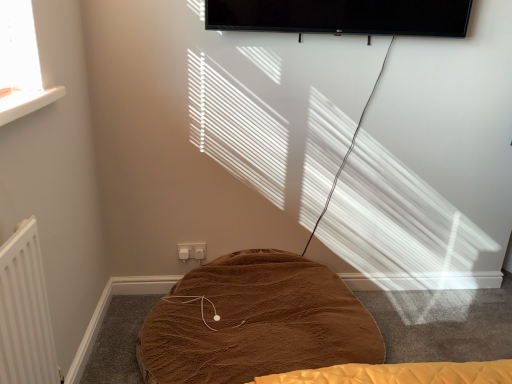
The image size is (512, 384). What do you see at coordinates (255, 322) in the screenshot?
I see `brown plush blanket at center` at bounding box center [255, 322].

The image size is (512, 384). In order to click on brown plush blanket at center in this screenshot , I will do `click(255, 322)`.

At what (x,y) coordinates should I click in order to perform the action: click on white plastic electric outlet at lower center. Please return your answer as a coordinate pair (x, y). Looking at the image, I should click on (192, 251).

What do you see at coordinates (192, 251) in the screenshot? I see `white plastic electric outlet at lower center` at bounding box center [192, 251].

Locate an element on the screen. The height and width of the screenshot is (384, 512). brown plush blanket at center is located at coordinates (255, 322).

Considering the positions of objects white plastic electric outlet at lower center and brown plush blanket at center in the image provided, who is more to the left, white plastic electric outlet at lower center or brown plush blanket at center?

Positioned to the left is white plastic electric outlet at lower center.

Which object is closer to the camera, white plastic electric outlet at lower center or brown plush blanket at center?

Positioned in front is brown plush blanket at center.

Between point (180, 256) and point (256, 283), which one is positioned behind?

Point (180, 256)

Based on the photo, from the image's perspective, is white plastic electric outlet at lower center above brown plush blanket at center?

Yes.

From a real-world perspective, is white plastic electric outlet at lower center above or below brown plush blanket at center?

white plastic electric outlet at lower center is situated higher than brown plush blanket at center in the real world.

Which of these two, white plastic electric outlet at lower center or brown plush blanket at center, is wider?

brown plush blanket at center is wider.

Considering the relative sizes of white plastic electric outlet at lower center and brown plush blanket at center in the image provided, is white plastic electric outlet at lower center taller than brown plush blanket at center?

Incorrect, the height of white plastic electric outlet at lower center is not larger of that of brown plush blanket at center.

Is white plastic electric outlet at lower center smaller than brown plush blanket at center?

Yes.

Is white plastic electric outlet at lower center inside or outside of brown plush blanket at center?

white plastic electric outlet at lower center is spatially situated outside brown plush blanket at center.

Does white plastic electric outlet at lower center touch brown plush blanket at center?

No, white plastic electric outlet at lower center is not beside brown plush blanket at center.

Is white plastic electric outlet at lower center oriented towards brown plush blanket at center?

Yes, white plastic electric outlet at lower center is aimed at brown plush blanket at center.

Can you tell me how much white plastic electric outlet at lower center and brown plush blanket at center differ in facing direction?

white plastic electric outlet at lower center and brown plush blanket at center are facing 0.181 degrees away from each other.

Identify the location of electric outlet above the brown plush blanket at center (from a real-world perspective). 192,251.

Consider the image. Can you confirm if brown plush blanket at center is positioned to the left of white plastic electric outlet at lower center?

No, brown plush blanket at center is not to the left of white plastic electric outlet at lower center.

Does brown plush blanket at center come in front of white plastic electric outlet at lower center?

That is True.

Which is nearer, (167, 367) or (198, 244)?

Point (167, 367) is closer to the camera than point (198, 244).

From the picture: From the image's perspective, which one is positioned higher, brown plush blanket at center or white plastic electric outlet at lower center?

white plastic electric outlet at lower center.

From a real-world perspective, does brown plush blanket at center stand above white plastic electric outlet at lower center?

No, from a real-world perspective, brown plush blanket at center is not above white plastic electric outlet at lower center.

Is brown plush blanket at center wider or thinner than white plastic electric outlet at lower center?

Considering their sizes, brown plush blanket at center looks broader than white plastic electric outlet at lower center.

Which of these two, brown plush blanket at center or white plastic electric outlet at lower center, stands taller?

Standing taller between the two is brown plush blanket at center.

Does brown plush blanket at center have a larger size compared to white plastic electric outlet at lower center?

Yes, brown plush blanket at center is bigger than white plastic electric outlet at lower center.

Is brown plush blanket at center completely or partially outside of white plastic electric outlet at lower center?

Yes, brown plush blanket at center is not within white plastic electric outlet at lower center.

Is brown plush blanket at center next to white plastic electric outlet at lower center?

There is a gap between brown plush blanket at center and white plastic electric outlet at lower center.

From the picture: Is brown plush blanket at center positioned with its back to white plastic electric outlet at lower center?

Yes.

What's the angular difference between brown plush blanket at center and white plastic electric outlet at lower center's facing directions?

The angular difference between brown plush blanket at center and white plastic electric outlet at lower center is 0.181 degrees.

The image size is (512, 384). Identify the location of electric outlet that is above the brown plush blanket at center (from a real-world perspective). (192, 251).

The height and width of the screenshot is (384, 512). What are the coordinates of `electric outlet located above the brown plush blanket at center (from the image's perspective)` in the screenshot? It's located at (192, 251).

Find the location of a particular element. electric outlet on the left of brown plush blanket at center is located at coordinates (192, 251).